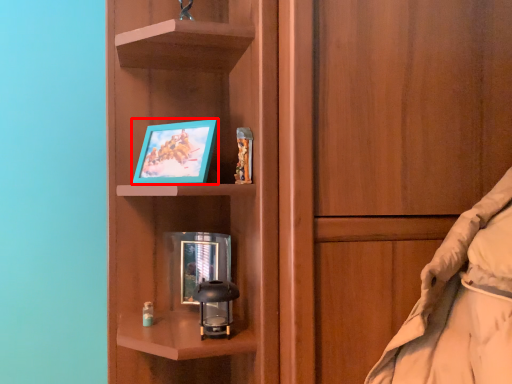
Question: In this image, where is picture frame (annotated by the red box) located relative to picture frame?

Choices:
 (A) left
 (B) right

Answer: (A)